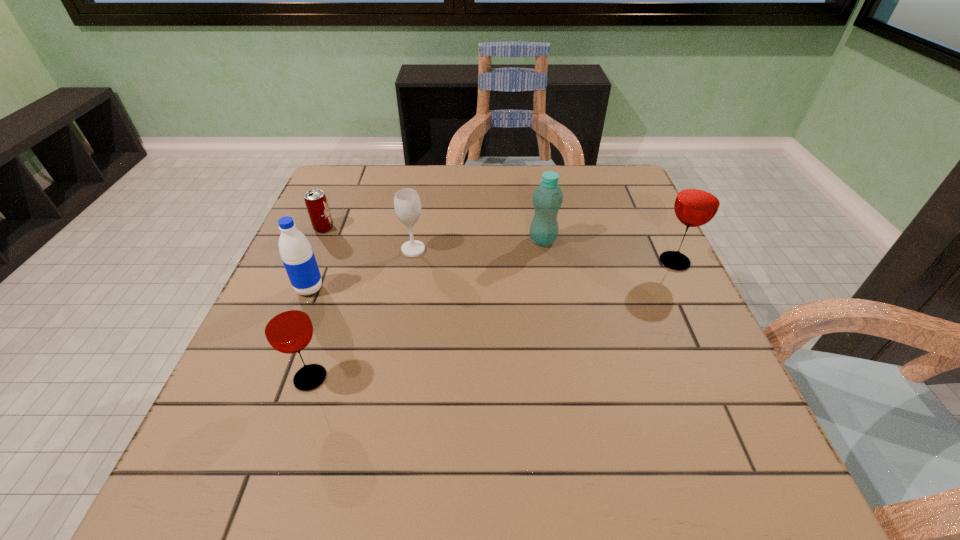
Where is `object identified as the third closest to the beer can`? object identified as the third closest to the beer can is located at coordinates (287, 326).

Where is `object that is the closest to the shorter glass`? object that is the closest to the shorter glass is located at coordinates (298, 258).

The image size is (960, 540). Identify the location of blank area in the image that satisfies the following two spatial constraints: 1. at the front cap of the rightmost object; 2. on the right side of the second object from right to left. (546, 262).

Identify the location of free space that satisfies the following two spatial constraints: 1. on the back side of the right glass; 2. on the left side of the nearer water bottle. (321, 262).

Locate an element on the screen. The image size is (960, 540). free space that satisfies the following two spatial constraints: 1. on the front side of the shortest object; 2. on the right side of the second nearest object is located at coordinates (298, 289).

I want to click on free space that satisfies the following two spatial constraints: 1. on the back side of the nearer glass; 2. on the right side of the second shortest object, so click(x=353, y=249).

The height and width of the screenshot is (540, 960). In order to click on vacant area that satisfies the following two spatial constraints: 1. on the back side of the tallest object; 2. at the front cap of the farther water bottle in this screenshot , I will do `click(664, 240)`.

At what (x,y) coordinates should I click in order to perform the action: click on free space that satisfies the following two spatial constraints: 1. on the back side of the wineglass; 2. on the right side of the second nearest object. Please return your answer as a coordinate pair (x, y). This screenshot has height=540, width=960. Looking at the image, I should click on (325, 249).